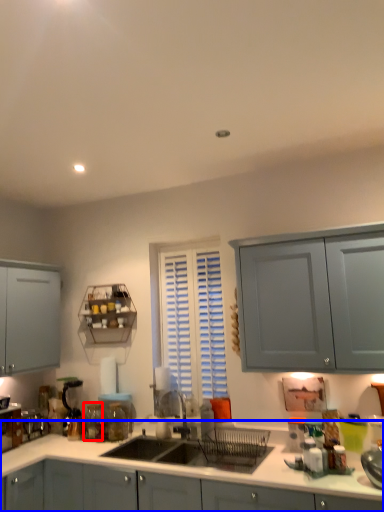
Question: Which object appears closest to the camera in this image, glass jar (highlighted by a red box) or cabinetry (highlighted by a blue box)?

Choices:
 (A) glass jar
 (B) cabinetry

Answer: (B)